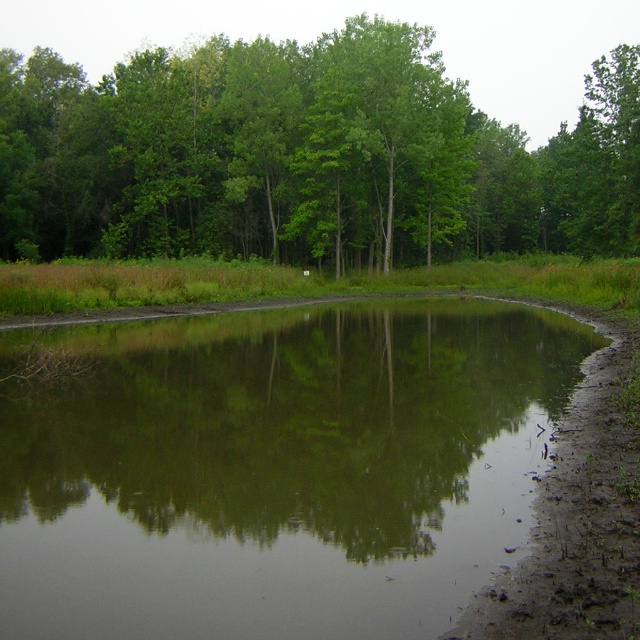
Question: Among these objects, which one is farthest from the camera?

Choices:
 (A) green leafy trees at upper center
 (B) green reflective mud at center

Answer: (A)

Question: Which point is closer to the camera taking this photo?

Choices:
 (A) (28, 188)
 (B) (49, 564)

Answer: (B)

Question: Among these points, which one is nearest to the camera?

Choices:
 (A) (401, 60)
 (B) (173, 449)

Answer: (B)

Question: From the image, what is the correct spatial relationship of green reflective mud at center in relation to green leafy trees at upper center?

Choices:
 (A) right
 (B) left

Answer: (A)

Question: Does green reflective mud at center have a lesser width compared to green leafy trees at upper center?

Choices:
 (A) no
 (B) yes

Answer: (B)

Question: Where is green reflective mud at center located in relation to green leafy trees at upper center in the image?

Choices:
 (A) below
 (B) above

Answer: (A)